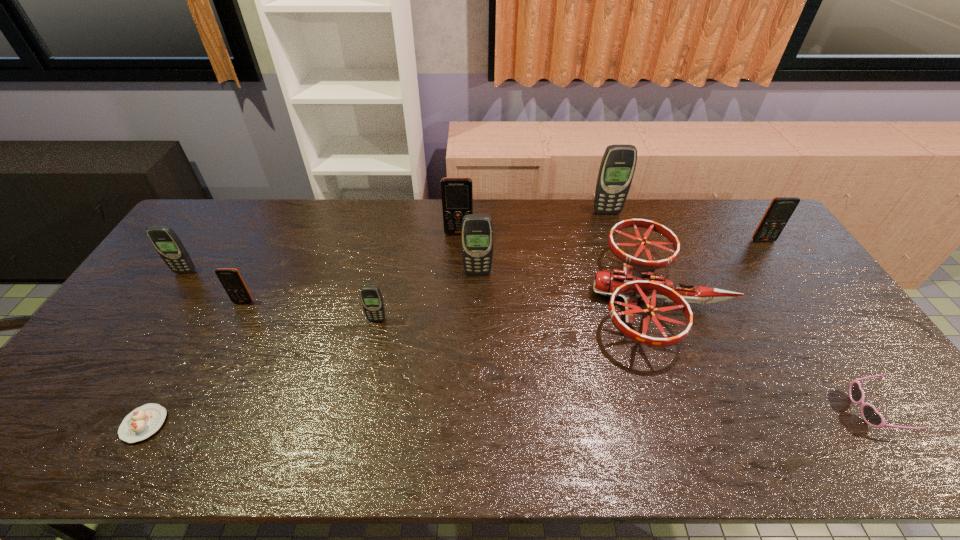
Locate an element on the screen. The image size is (960, 540). free space at the right edge of the desktop is located at coordinates (790, 315).

This screenshot has width=960, height=540. In the image, there is a desktop. Identify the location of vacant area at the near right corner. (893, 435).

This screenshot has height=540, width=960. Find the location of `vacant area between the second gray cellular telephone from left to right and the third smallest gray cellular telephone`. vacant area between the second gray cellular telephone from left to right and the third smallest gray cellular telephone is located at coordinates (427, 296).

What are the coordinates of `vacant region between the smallest gray cellular telephone and the third gray cellular telephone from left to right` in the screenshot? It's located at click(x=427, y=296).

Locate an element on the screen. vacant area between the leftmost object and the biggest gray cellular telephone is located at coordinates pyautogui.click(x=396, y=242).

Where is `vacant space that's between the third smallest gray cellular telephone and the nearest gray cellular telephone`? vacant space that's between the third smallest gray cellular telephone and the nearest gray cellular telephone is located at coordinates (427, 296).

Locate an element on the screen. vacant space that's between the farthest cellular telephone and the second farthest cellular telephone is located at coordinates (533, 223).

The height and width of the screenshot is (540, 960). In order to click on free space between the farthest object and the third farthest cellular telephone in this screenshot , I will do `click(684, 227)`.

Locate an element on the screen. This screenshot has width=960, height=540. free spot between the sunglasses and the second object from left to right is located at coordinates (509, 417).

Where is `unoccupied position between the leftmost object and the shortest object`? The image size is (960, 540). unoccupied position between the leftmost object and the shortest object is located at coordinates (165, 348).